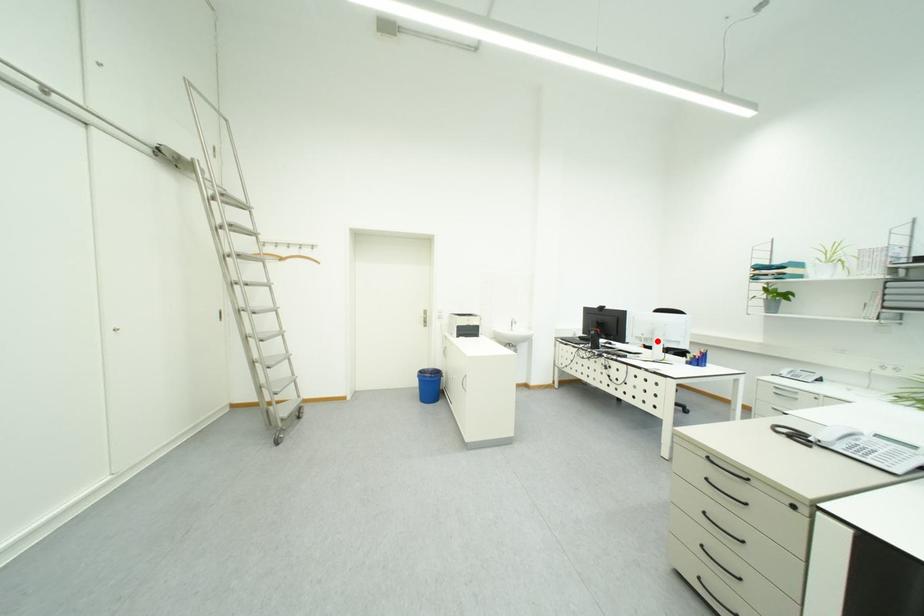
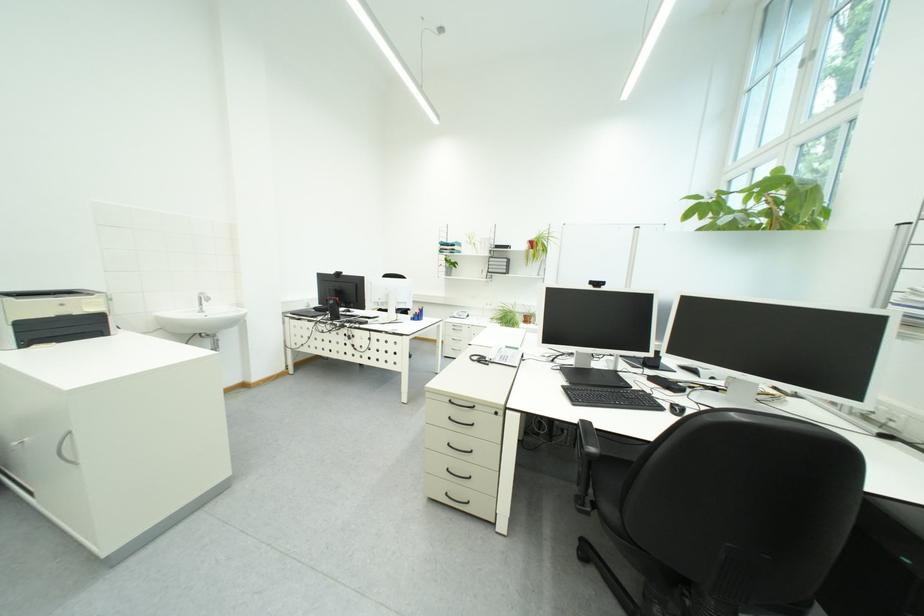
Where in the second image is the point corresponding to the highlighted location from the first image?

(394, 305)